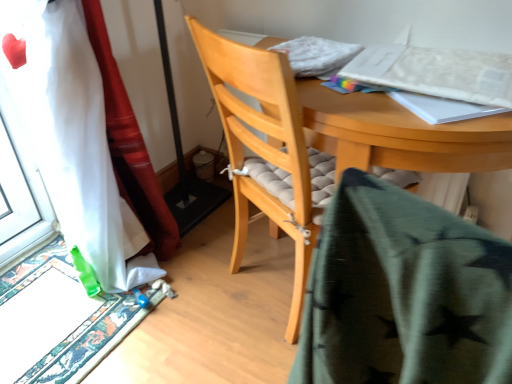
Question: Does carpeted doormat at lower left lie behind white paper at upper right?

Choices:
 (A) no
 (B) yes

Answer: (B)

Question: From a real-world perspective, is carpeted doormat at lower left over white paper at upper right?

Choices:
 (A) yes
 (B) no

Answer: (B)

Question: Is carpeted doormat at lower left thinner than white paper at upper right?

Choices:
 (A) no
 (B) yes

Answer: (A)

Question: Is carpeted doormat at lower left to the right of white paper at upper right from the viewer's perspective?

Choices:
 (A) no
 (B) yes

Answer: (A)

Question: Is carpeted doormat at lower left next to white paper at upper right?

Choices:
 (A) no
 (B) yes

Answer: (A)

Question: Is green star-patterned fabric at center to the left or to the right of carpeted doormat at lower left in the image?

Choices:
 (A) left
 (B) right

Answer: (B)

Question: From a real-world perspective, relative to carpeted doormat at lower left, is green star-patterned fabric at center vertically above or below?

Choices:
 (A) below
 (B) above

Answer: (B)

Question: Is green star-patterned fabric at center spatially inside carpeted doormat at lower left, or outside of it?

Choices:
 (A) inside
 (B) outside

Answer: (B)

Question: Relative to carpeted doormat at lower left, is green star-patterned fabric at center in front or behind?

Choices:
 (A) behind
 (B) front

Answer: (B)

Question: Is light wood chair at center wider or thinner than white sheer curtain at left?

Choices:
 (A) wide
 (B) thin

Answer: (A)

Question: From the image's perspective, is light wood chair at center positioned above or below white sheer curtain at left?

Choices:
 (A) below
 (B) above

Answer: (A)

Question: Is point (254, 178) closer or farther from the camera than point (117, 150)?

Choices:
 (A) closer
 (B) farther

Answer: (A)

Question: Considering their positions, is light wood chair at center located in front of or behind white sheer curtain at left?

Choices:
 (A) behind
 (B) front

Answer: (A)

Question: Considering the positions of point (354, 72) and point (156, 218), is point (354, 72) closer or farther from the camera than point (156, 218)?

Choices:
 (A) closer
 (B) farther

Answer: (A)

Question: Looking at their shapes, would you say white paper at upper right is wider or thinner than white sheer curtain at left?

Choices:
 (A) wide
 (B) thin

Answer: (B)